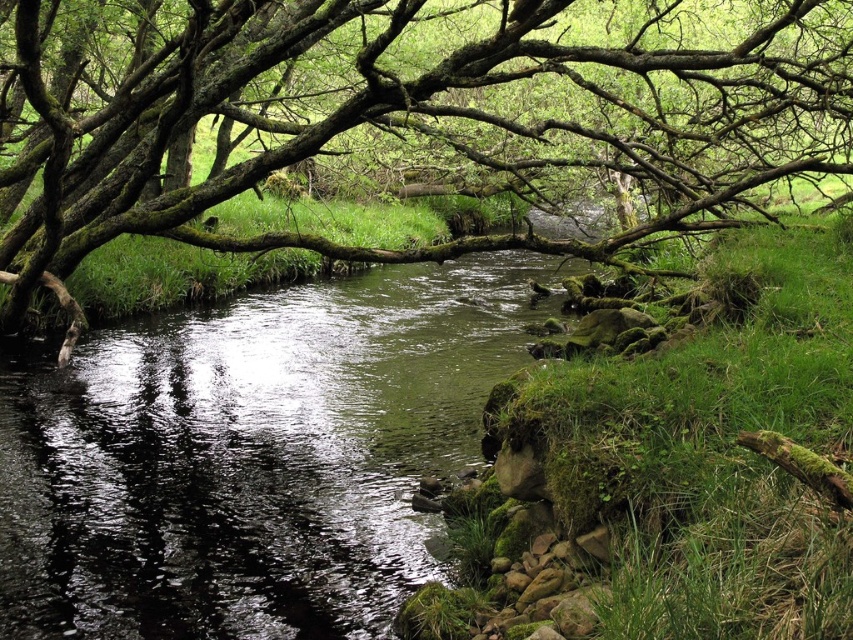
Question: Observing the image, what is the correct spatial positioning of green mossy branches at upper center in reference to green mossy water at center?

Choices:
 (A) right
 (B) left

Answer: (A)

Question: Is green mossy branches at upper center to the left of green mossy water at center from the viewer's perspective?

Choices:
 (A) yes
 (B) no

Answer: (B)

Question: Does green mossy branches at upper center appear under green mossy water at center?

Choices:
 (A) yes
 (B) no

Answer: (B)

Question: Which point is closer to the camera?

Choices:
 (A) green mossy water at center
 (B) green mossy branches at upper center

Answer: (A)